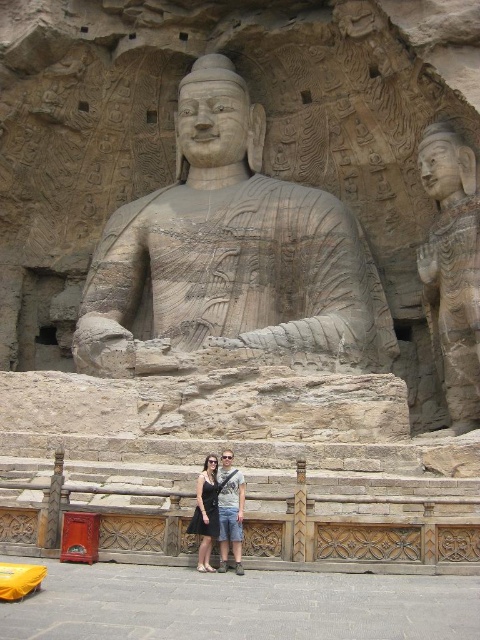
You are an art conservator examining the cave carvings. You need to clean both the gray stone statue at center and the light brown stone statue at center. Which statue should you clean first if you want to start with the one closer to you?

You should clean the gray stone statue at center first because it is closer to you than the light brown stone statue at center, as stated in the description.

You are an art conservator examining the cave carvings. You need to clean the light brown stone statue at center and the matte stone statue at upper right. Which statue should you clean first if you want to start with the one that is farther from the entrance?

The light brown stone statue at center is behind the matte stone statue at upper right, so you should clean the light brown stone statue at center first since it is farther from the entrance.

You are a photographer standing in front of the stone Buddha statue in the cave. You want to take a photo that includes both point [439,282] and point [225,472]. Which point will appear closer to the camera in the photo?

Point [225,472] will appear closer to the camera in the photo because it is physically closer to the camera than point [439,282], which is further away.